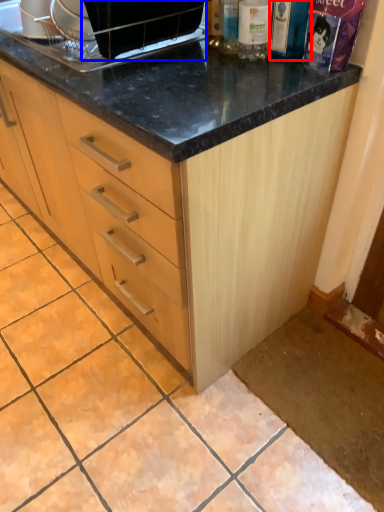
Question: Which object is closer to the camera taking this photo, bottle (highlighted by a red box) or appliance (highlighted by a blue box)?

Choices:
 (A) bottle
 (B) appliance

Answer: (B)